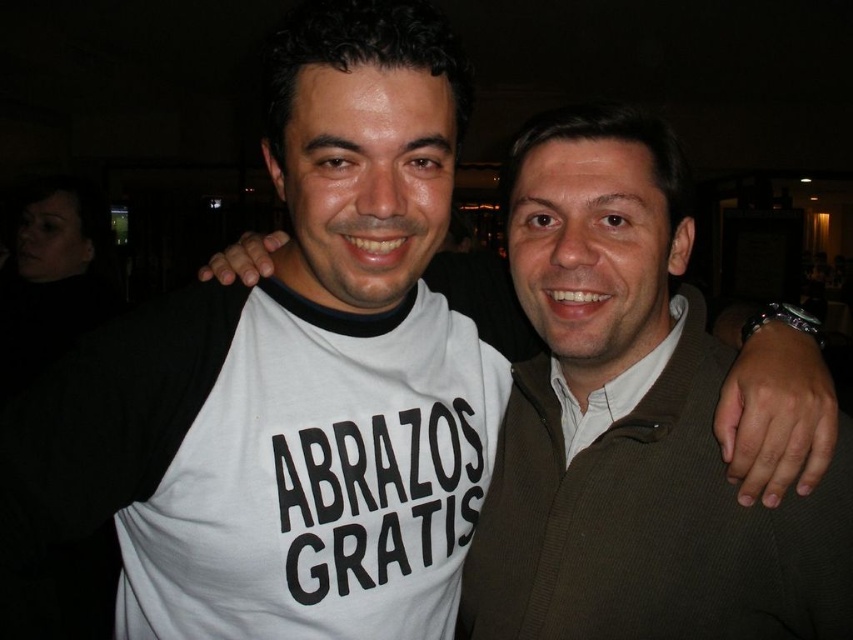
You are a photographer trying to capture a clear photo of both the white cotton shirt at center and the matte brown shirt at center. Based on their positions, which one is closer to the camera?

The white cotton shirt at center is in front of the matte brown shirt at center, so it is closer to the camera.

You are a photographer trying to focus on the white cotton shirt at center in the image. The camera has a focus point at coordinate point (x=648, y=525). Is this focus point correctly positioned to capture the white cotton shirt at center?

Yes, the focus point at coordinate point (x=648, y=525) is correctly positioned because the Objects Description states that this point corresponds to the white cotton shirt at center.